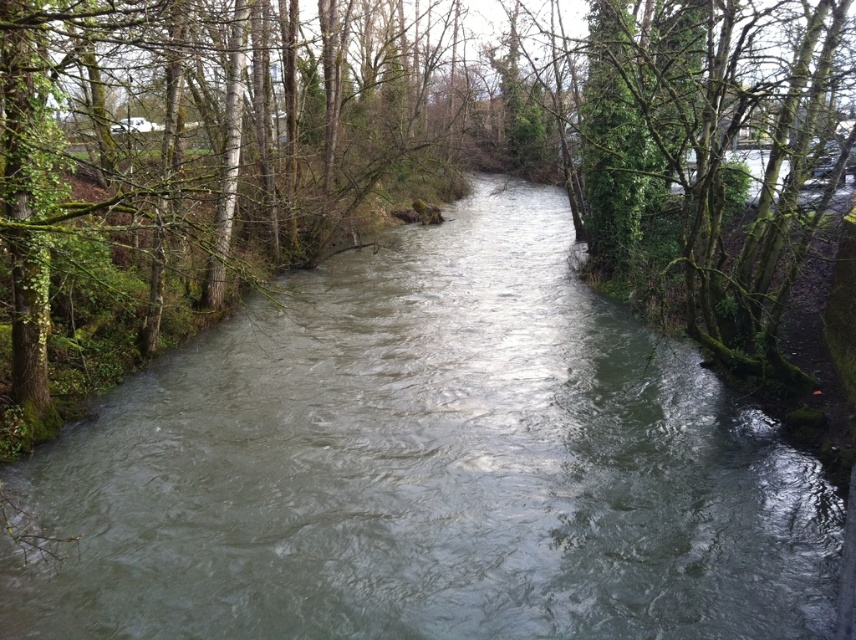
Question: Which object appears farthest from the camera in this image?

Choices:
 (A) gray/rough water at center
 (B) green mossy tree at center

Answer: (A)

Question: Can you confirm if gray/rough water at center is bigger than green mossy tree at center?

Choices:
 (A) yes
 (B) no

Answer: (B)

Question: Is gray/rough water at center above green mossy tree at center?

Choices:
 (A) yes
 (B) no

Answer: (B)

Question: Which point appears closest to the camera in this image?

Choices:
 (A) (75, 163)
 (B) (407, 387)

Answer: (A)

Question: Does gray/rough water at center have a larger size compared to green mossy tree at center?

Choices:
 (A) no
 (B) yes

Answer: (A)